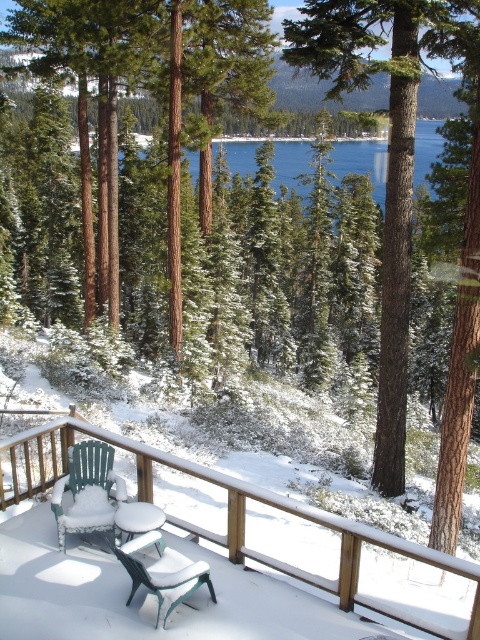
You are standing on the wooden deck and want to take a photo of the brown textured tree at center. If your camera has a maximum zoom range of 5 meters, will you need to zoom in to capture the tree clearly?

The brown textured tree at center is 8.79 meters from viewer, which is beyond the camera maximum zoom range of 5 meters. Therefore, you will need to zoom in to capture the tree clearly.

You are standing on the wooden deck and want to take a photo of the blue water at center. Where should you aim your camera to capture it?

You should aim your camera at point 0.273 on the x axis and 0.925 on the y axis to capture the blue water at center.